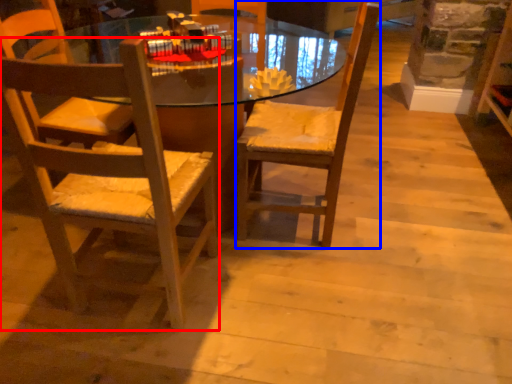
Question: Which object appears closest to the camera in this image, chair (highlighted by a red box) or chair (highlighted by a blue box)?

Choices:
 (A) chair
 (B) chair

Answer: (A)